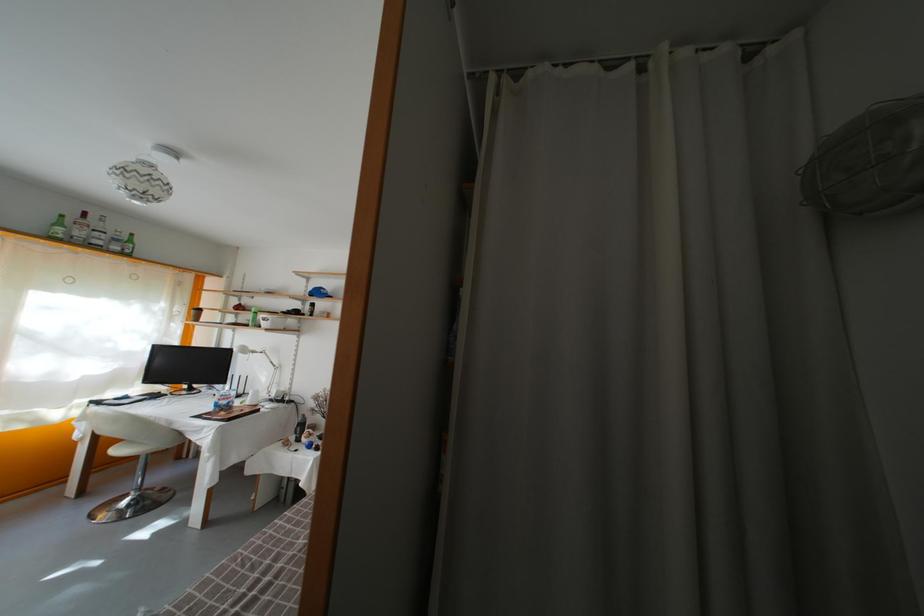
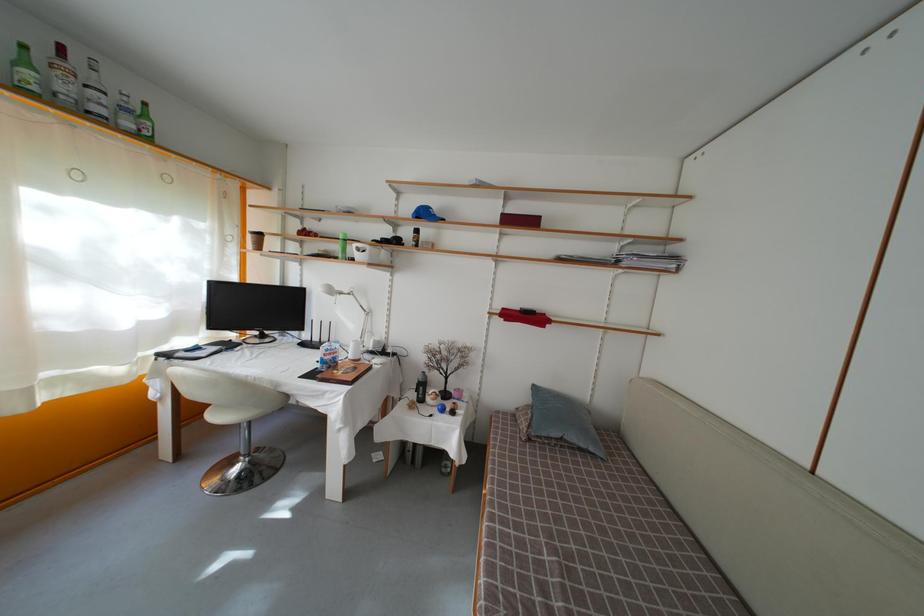
Locate, in the second image, the point that corresponds to point (67, 230) in the first image.

(31, 69)